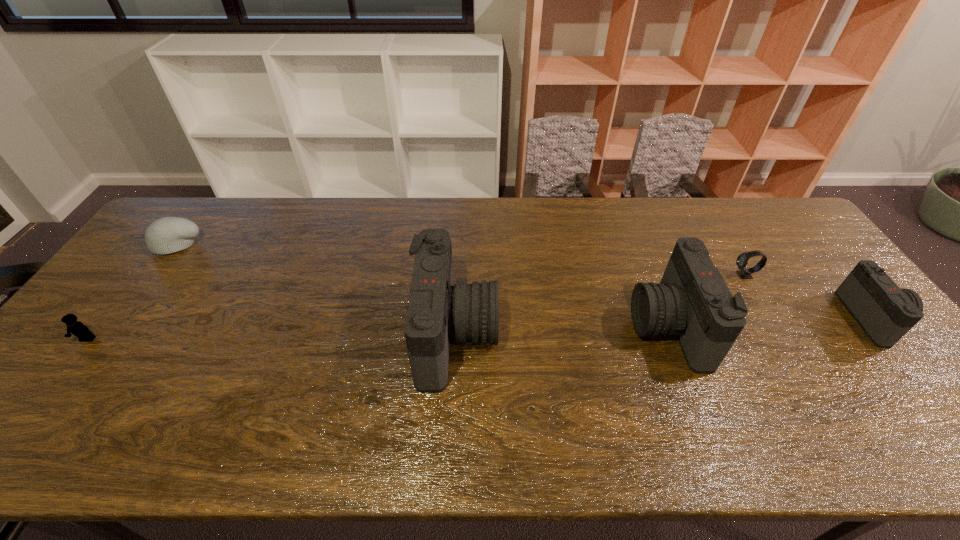
You are a GUI agent. You are given a task and a screenshot of the screen. Output one action in this format:
    pyautogui.click(x=<x>, y=<y>)
    Task: Click on the free space located 0.150m at the lens of the second camera from left to right
    
    Given the screenshot: What is the action you would take?
    pyautogui.click(x=577, y=326)

I want to click on vacant space located at the lens of the second camera from left to right, so click(x=536, y=326).

At what (x,y) coordinates should I click in order to perform the action: click on free space located 0.250m at the lens of the second camera from left to right. Please return your answer as a coordinate pair (x, y). Looking at the image, I should click on (540, 326).

Find the location of a particular element. free region located on the face of the second object from right to left is located at coordinates (615, 275).

In order to click on vacant space located 0.230m on the face of the second object from right to left in this screenshot , I will do `click(655, 275)`.

Identify the location of vacant space situated on the face of the second object from right to left. This screenshot has width=960, height=540. (675, 275).

Image resolution: width=960 pixels, height=540 pixels. I want to click on free location located 0.110m on the right of the farthest object, so point(237,244).

You are a GUI agent. You are given a task and a screenshot of the screen. Output one action in this format:
    pyautogui.click(x=<x>, y=<y>)
    Task: Click on the free space located on the front-facing side of the Lego
    
    Given the screenshot: What is the action you would take?
    point(48,390)

Locate an element on the screen. object that is at the far edge is located at coordinates (166, 235).

Locate an element on the screen. object located at the near edge is located at coordinates (438, 311).